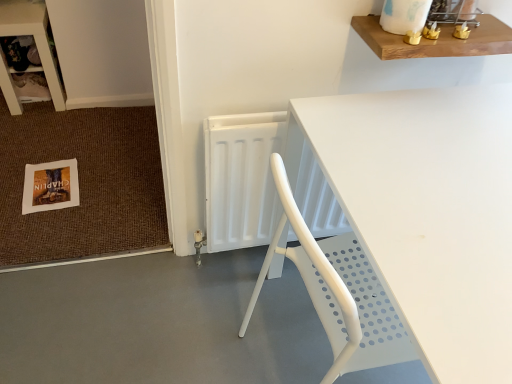
Identify the location of free space to the back side of white paper postcard at lower left. This screenshot has width=512, height=384. (75, 148).